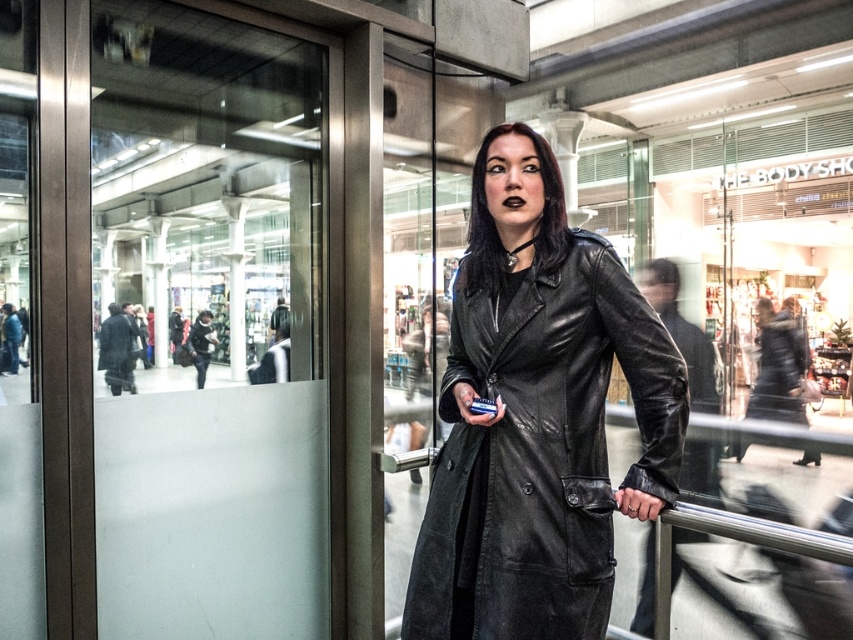
Question: Is transparent frosted glass at left above matte black coat at center?

Choices:
 (A) yes
 (B) no

Answer: (A)

Question: Which object appears closest to the camera in this image?

Choices:
 (A) matte black coat at center
 (B) leather coat at center

Answer: (A)

Question: Which object appears closest to the camera in this image?

Choices:
 (A) transparent frosted glass at left
 (B) leather coat at center
 (C) matte black coat at center

Answer: (C)

Question: Is the position of matte black coat at center more distant than that of leather coat at center?

Choices:
 (A) no
 (B) yes

Answer: (A)

Question: Is matte black coat at center below leather coat at center?

Choices:
 (A) yes
 (B) no

Answer: (B)

Question: Which point is closer to the camera taking this photo?

Choices:
 (A) (318, 248)
 (B) (772, 387)

Answer: (A)